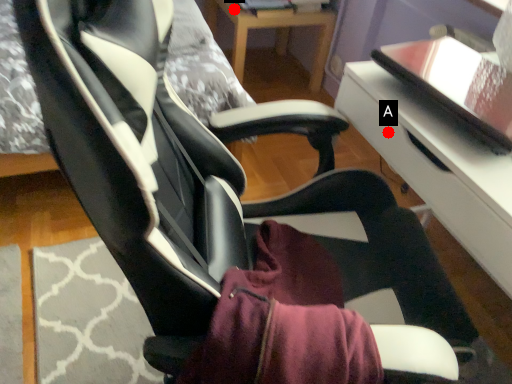
Question: Two points are circled on the image, labeled by A and B beside each circle. Which point is farther to the camera?

Choices:
 (A) A is further
 (B) B is further

Answer: (B)